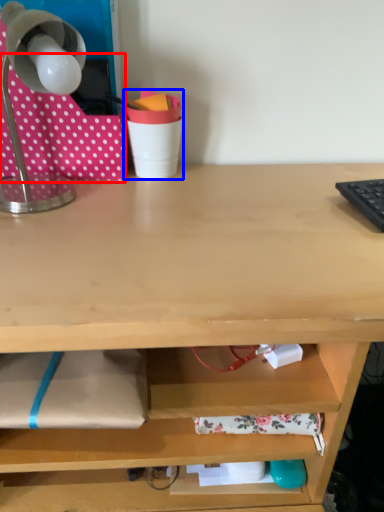
Question: Which point is further to the camera, fabric (highlighted by a red box) or stationery (highlighted by a blue box)?

Choices:
 (A) fabric
 (B) stationery

Answer: (B)